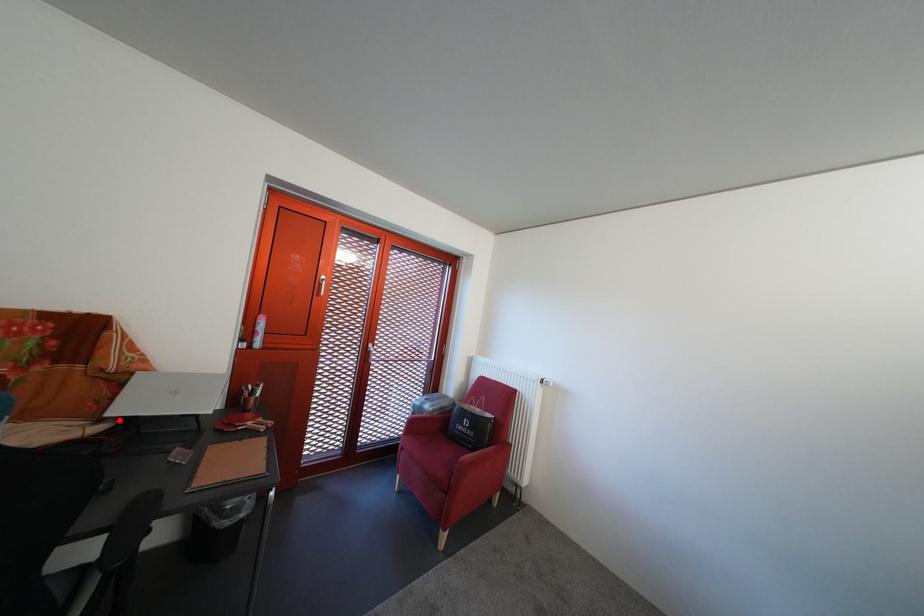
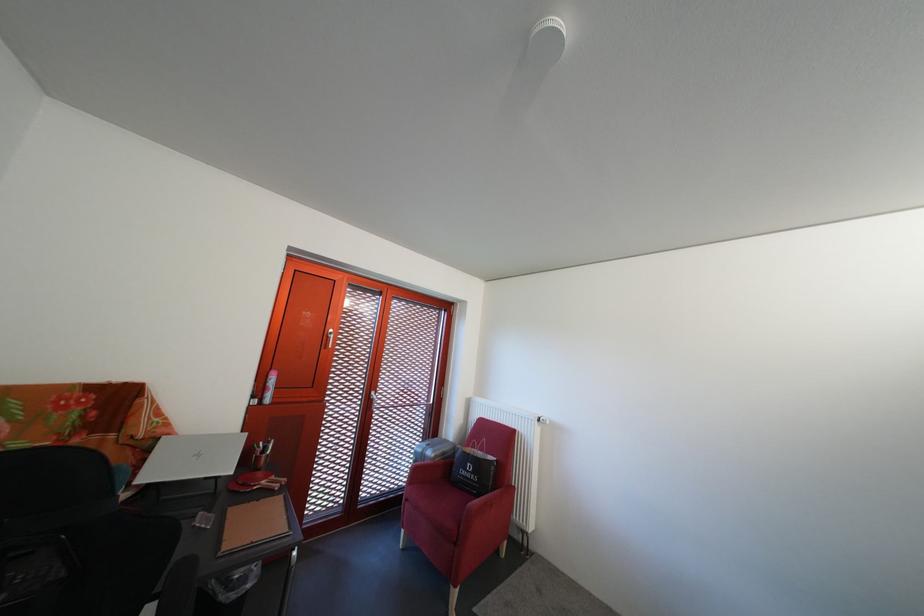
Locate, in the second image, the point that corresponds to the highlighted location in the first image.

(147, 488)